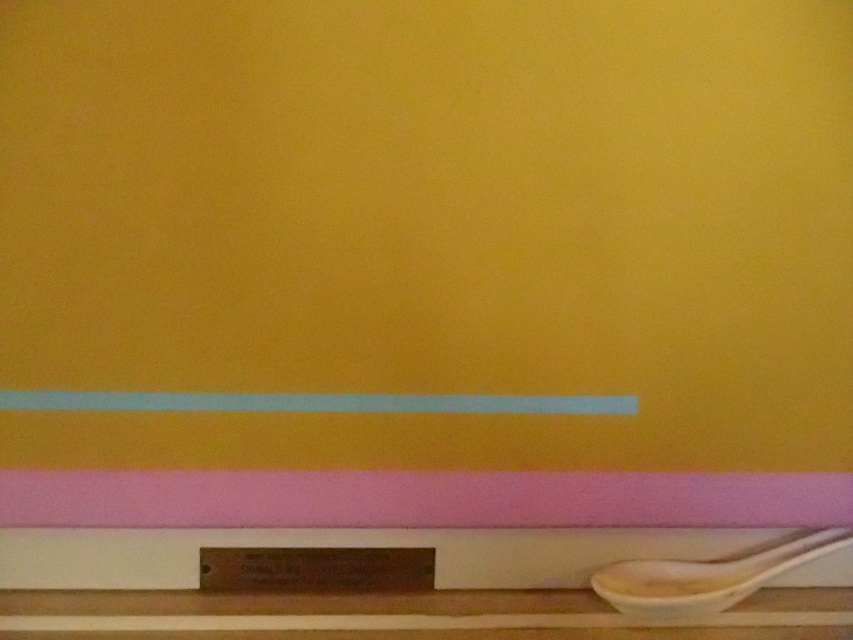
Based on the photo, who is more forward, (583, 401) or (724, 593)?

Point (724, 593)

Can you confirm if white glossy strip at lower center is thinner than white ceramic spoon at lower right?

In fact, white glossy strip at lower center might be wider than white ceramic spoon at lower right.

The image size is (853, 640). I want to click on white glossy strip at lower center, so click(x=315, y=403).